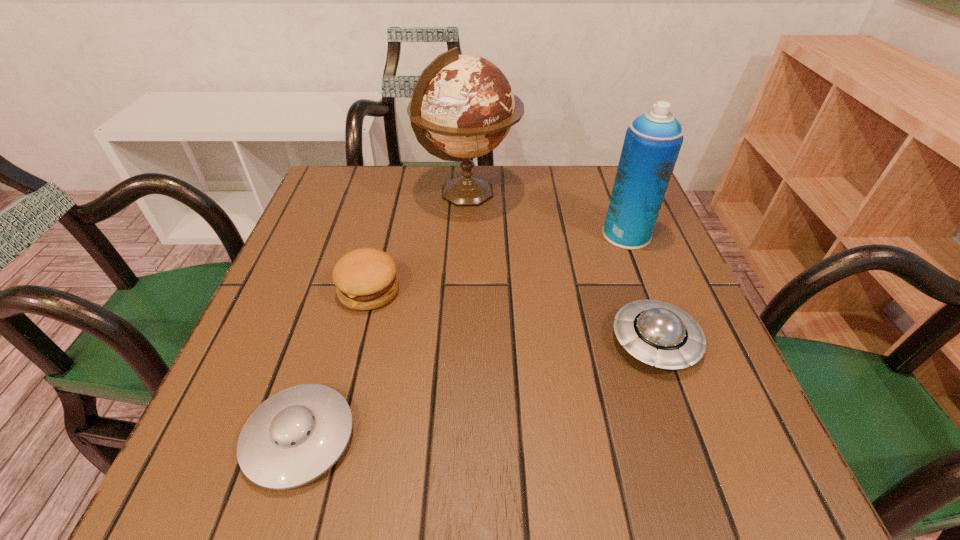
Image resolution: width=960 pixels, height=540 pixels. In the image, there is a desktop. In order to click on vacant space at the near edge in this screenshot , I will do `click(633, 487)`.

In the image, there is a desktop. Find the location of `free region at the left edge`. free region at the left edge is located at coordinates (298, 228).

In the image, there is a desktop. At what (x,y) coordinates should I click in order to perform the action: click on vacant space at the far left corner. Please return your answer as a coordinate pair (x, y). Looking at the image, I should click on (359, 179).

At what (x,y) coordinates should I click in order to perform the action: click on free space at the near left corner of the desktop. Please return your answer as a coordinate pair (x, y). Image resolution: width=960 pixels, height=540 pixels. Looking at the image, I should click on (226, 470).

Locate an element on the screen. The image size is (960, 540). free space that is in between the right saucer and the aerosol can is located at coordinates tap(640, 288).

At what (x,y) coordinates should I click in order to perform the action: click on blank region between the third object from right to left and the left saucer. Please return your answer as a coordinate pair (x, y). Image resolution: width=960 pixels, height=540 pixels. Looking at the image, I should click on (384, 315).

The width and height of the screenshot is (960, 540). I want to click on vacant area that lies between the third shortest object and the fourth shortest object, so click(497, 262).

Locate an element on the screen. The height and width of the screenshot is (540, 960). vacant space that's between the third object from right to left and the nearer saucer is located at coordinates (384, 315).

I want to click on vacant area between the hamburger and the fourth tallest object, so click(x=512, y=316).

In order to click on empty space that is in between the third object from left to right and the nearest object in this screenshot , I will do `click(384, 315)`.